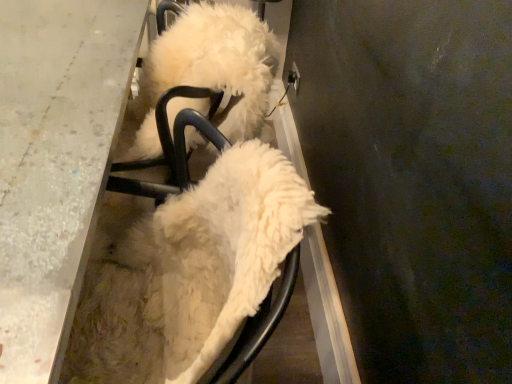
Question: Can you confirm if white glossy table at left is positioned to the right of white fluffy dog at center?

Choices:
 (A) yes
 (B) no

Answer: (B)

Question: From the image's perspective, is white glossy table at left under white fluffy dog at center?

Choices:
 (A) yes
 (B) no

Answer: (B)

Question: Can you confirm if white glossy table at left is bigger than white fluffy dog at center?

Choices:
 (A) yes
 (B) no

Answer: (A)

Question: Is white glossy table at left facing away from white fluffy dog at center?

Choices:
 (A) no
 (B) yes

Answer: (B)

Question: Is white glossy table at left positioned before white fluffy dog at center?

Choices:
 (A) no
 (B) yes

Answer: (A)

Question: Is white glossy table at left further to the viewer compared to white fluffy dog at center?

Choices:
 (A) yes
 (B) no

Answer: (A)

Question: Is white fluffy dog at center in contact with white glossy table at left?

Choices:
 (A) yes
 (B) no

Answer: (B)

Question: From the image's perspective, does white fluffy dog at center appear lower than white glossy table at left?

Choices:
 (A) yes
 (B) no

Answer: (A)

Question: Are white fluffy dog at center and white glossy table at left located far from each other?

Choices:
 (A) no
 (B) yes

Answer: (A)

Question: Does white fluffy dog at center have a lesser height compared to white glossy table at left?

Choices:
 (A) no
 (B) yes

Answer: (A)

Question: Does white fluffy dog at center have a greater width compared to white glossy table at left?

Choices:
 (A) no
 (B) yes

Answer: (B)

Question: Is white fluffy dog at center closer to camera compared to white glossy table at left?

Choices:
 (A) no
 (B) yes

Answer: (B)

Question: From the image's perspective, is white fluffy dog at center above or below white glossy table at left?

Choices:
 (A) above
 (B) below

Answer: (B)